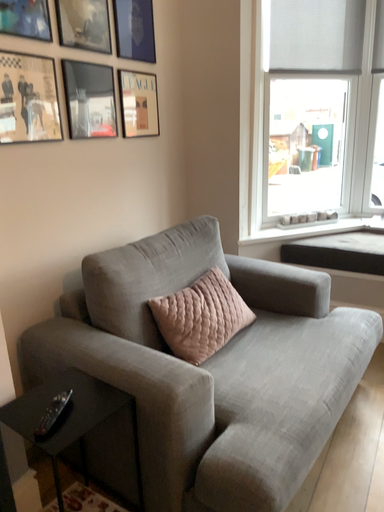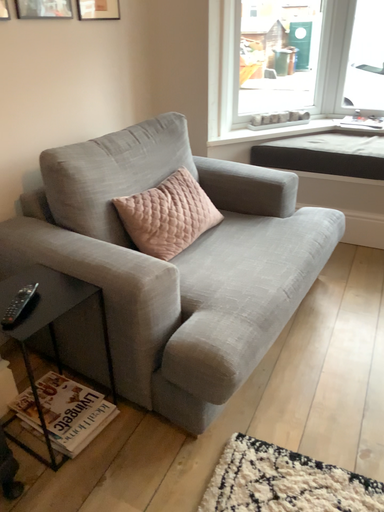
Question: How did the camera likely rotate when shooting the video?

Choices:
 (A) rotated downward
 (B) rotated upward

Answer: (A)